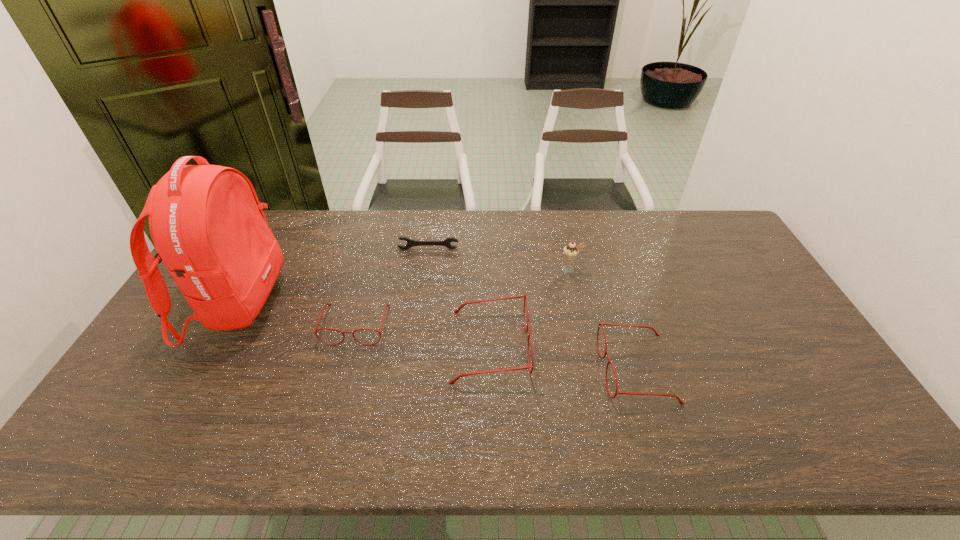
This screenshot has height=540, width=960. Find the location of `vacant spot to place a spectacles on the right`. vacant spot to place a spectacles on the right is located at coordinates (798, 395).